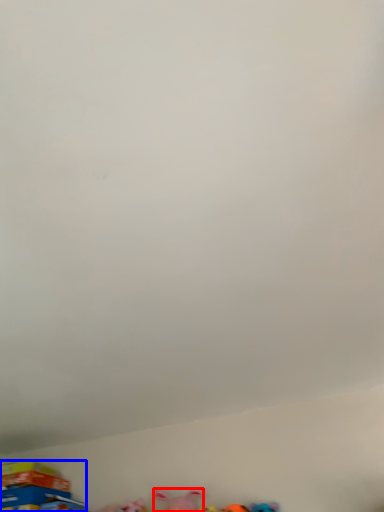
Question: Which object is closer to the camera taking this photo, toy (highlighted by a red box) or toy (highlighted by a blue box)?

Choices:
 (A) toy
 (B) toy

Answer: (A)